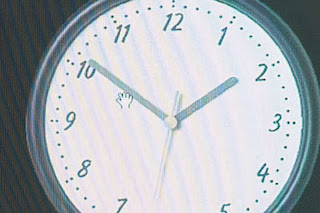
This screenshot has height=213, width=320. Identify the location of clock rim. (66, 34).